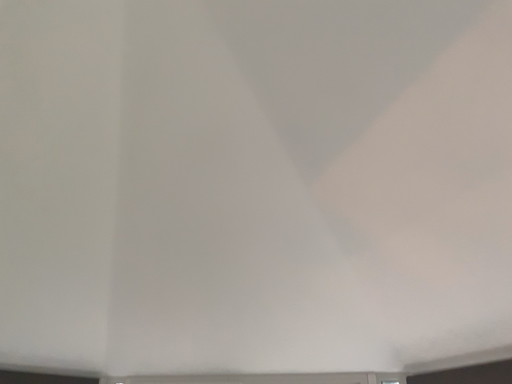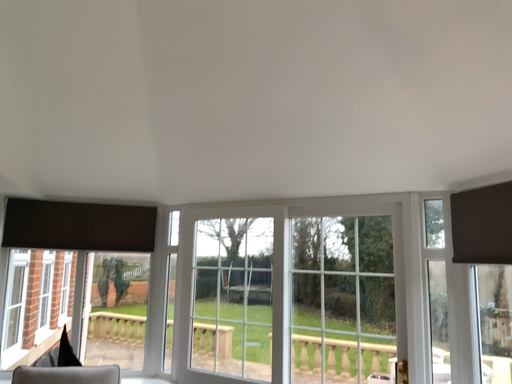
Question: How did the camera likely rotate when shooting the video?

Choices:
 (A) rotated downward
 (B) rotated upward

Answer: (A)